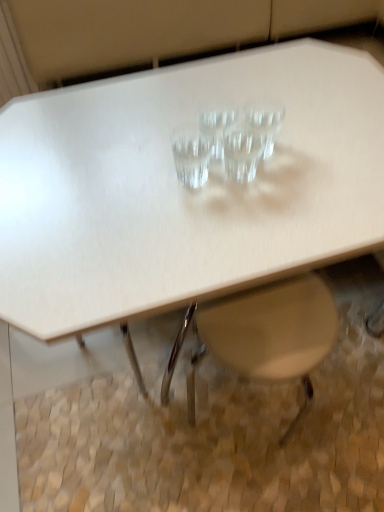
The height and width of the screenshot is (512, 384). Find the location of `vacant space behind transparent glass martini glass at center, acting as the 1th martini glass starting from the right`. vacant space behind transparent glass martini glass at center, acting as the 1th martini glass starting from the right is located at coordinates (248, 100).